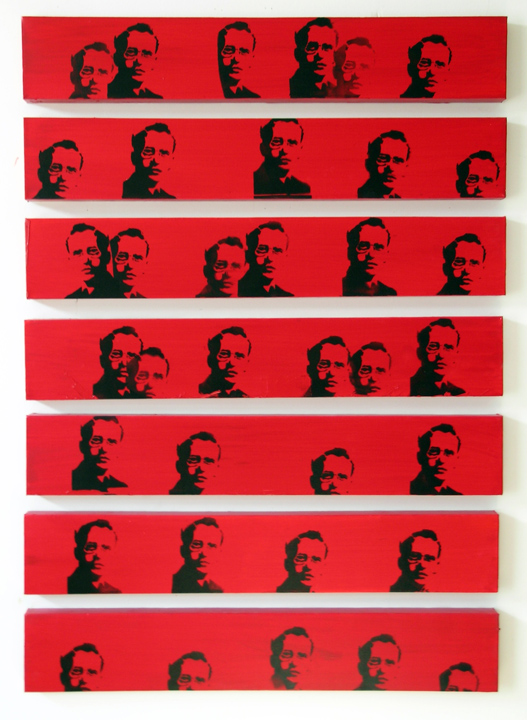
The width and height of the screenshot is (527, 720). What are the coordinates of `right edge of wooden slat` in the screenshot? It's located at (496, 654), (497, 551), (502, 449), (502, 355), (505, 260), (506, 158), (505, 52).